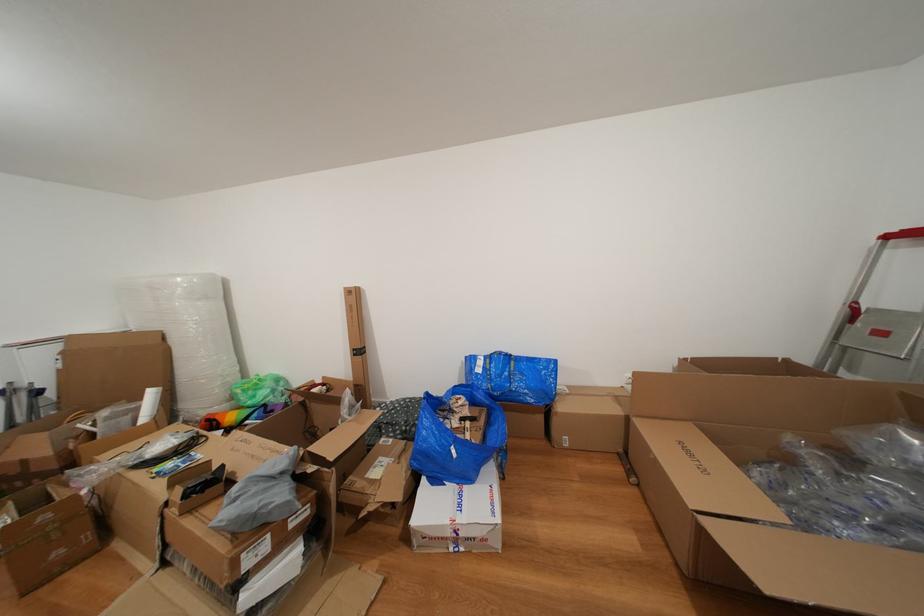
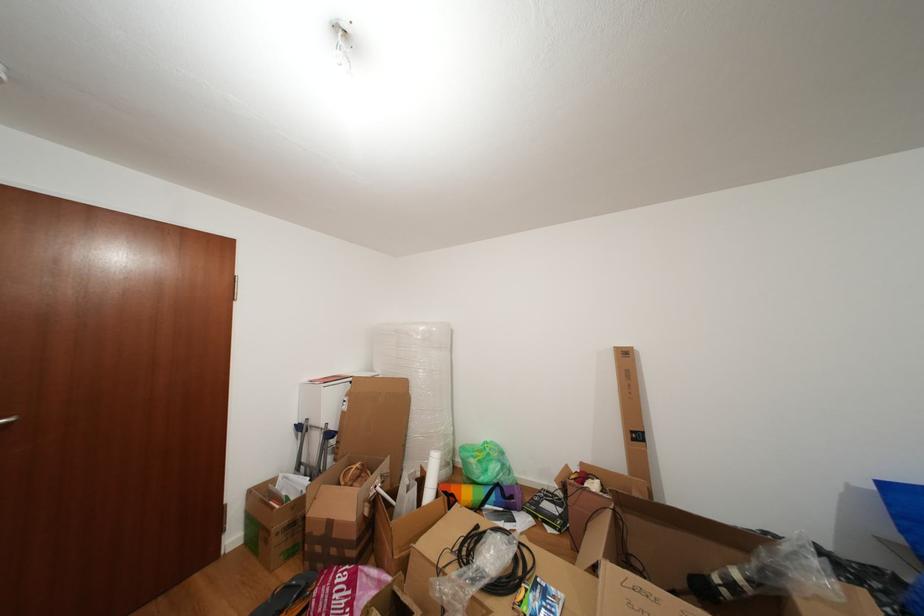
Where in the second image is the point corresponding to (x=226, y=387) from the first image?

(450, 448)